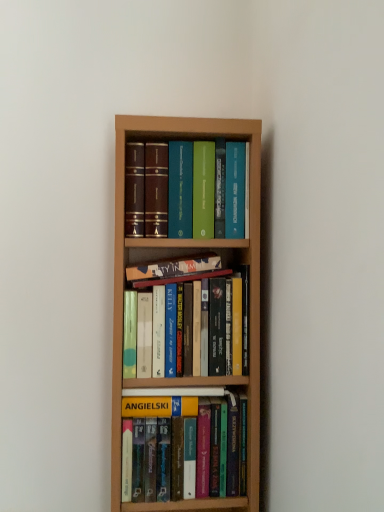
Question: Would you say hardcover books at center, which is the fourth book in bottom-to-top order, is inside or outside hardcover book at center, the second book in the top-to-bottom sequence?

Choices:
 (A) inside
 (B) outside

Answer: (B)

Question: From a real-world perspective, relative to hardcover book at center, the second book in the top-to-bottom sequence, is hardcover books at center, which is the fourth book in bottom-to-top order, vertically above or below?

Choices:
 (A) above
 (B) below

Answer: (A)

Question: Which object is positioned farthest from the hardcover book at center, arranged as the third book when ordered from the bottom?

Choices:
 (A) hardcover book at center, which ranks as the 4th book in top-to-bottom order
 (B) hardcover books at center, acting as the 1th book starting from the top
 (C) hardcover books at center, the third book in the top-to-bottom sequence

Answer: (A)

Question: Which object is the closest to the hardcover book at center, the 1th book from the bottom?

Choices:
 (A) hardcover books at center, acting as the 1th book starting from the top
 (B) hardcover books at center, the third book in the top-to-bottom sequence
 (C) hardcover book at center, the second book in the top-to-bottom sequence

Answer: (B)